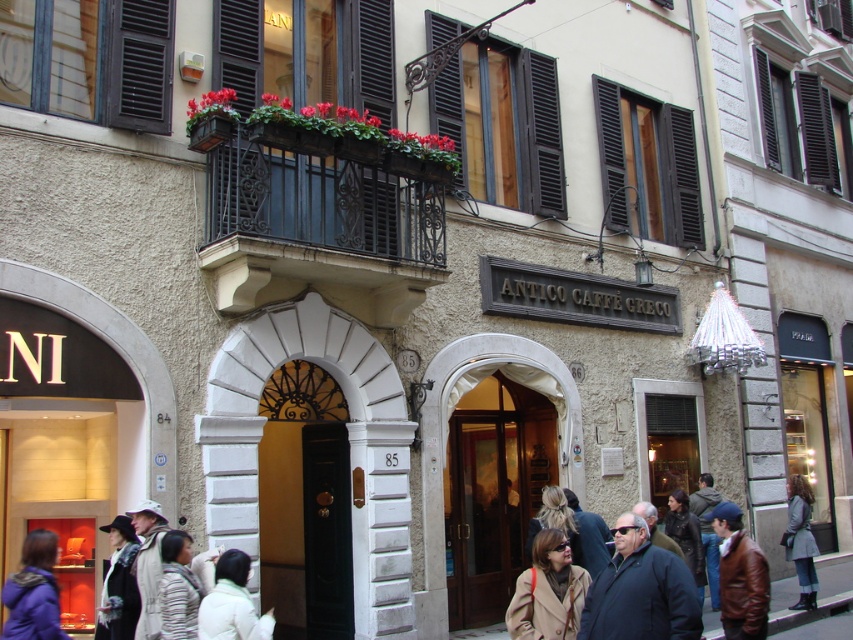
Question: Can you confirm if black wool coat at lower left is bigger than gray wool coat at lower right?

Choices:
 (A) yes
 (B) no

Answer: (B)

Question: Which point is closer to the camera?

Choices:
 (A) striped sweater at lower left
 (B) black polished wood door at center
 (C) purple fabric coat at lower left
 (D) beige wool coat at lower center

Answer: (C)

Question: In this image, where is beige wool coat at lower center located relative to white puffy coat at lower center?

Choices:
 (A) right
 (B) left

Answer: (A)

Question: Which object appears closest to the camera in this image?

Choices:
 (A) dark wood shutters at upper center
 (B) gray wool coat at lower right
 (C) brown leather jacket at lower right

Answer: (C)

Question: Does beige wool coat at lower center appear under purple fabric coat at lower left?

Choices:
 (A) no
 (B) yes

Answer: (B)

Question: Which of the following is the closest to the observer?

Choices:
 (A) brown leather jacket at lower right
 (B) white puffy coat at lower center
 (C) purple fabric coat at lower left

Answer: (C)